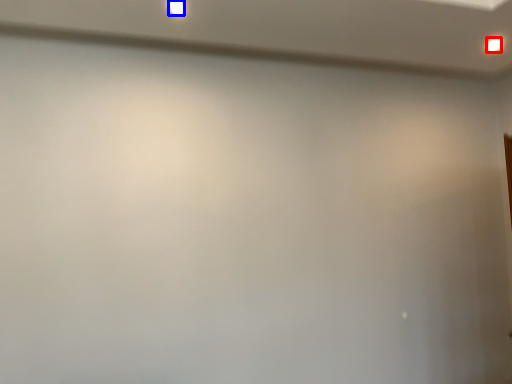
Question: Among these objects, which one is farthest to the camera, light (highlighted by a red box) or light (highlighted by a blue box)?

Choices:
 (A) light
 (B) light

Answer: (A)